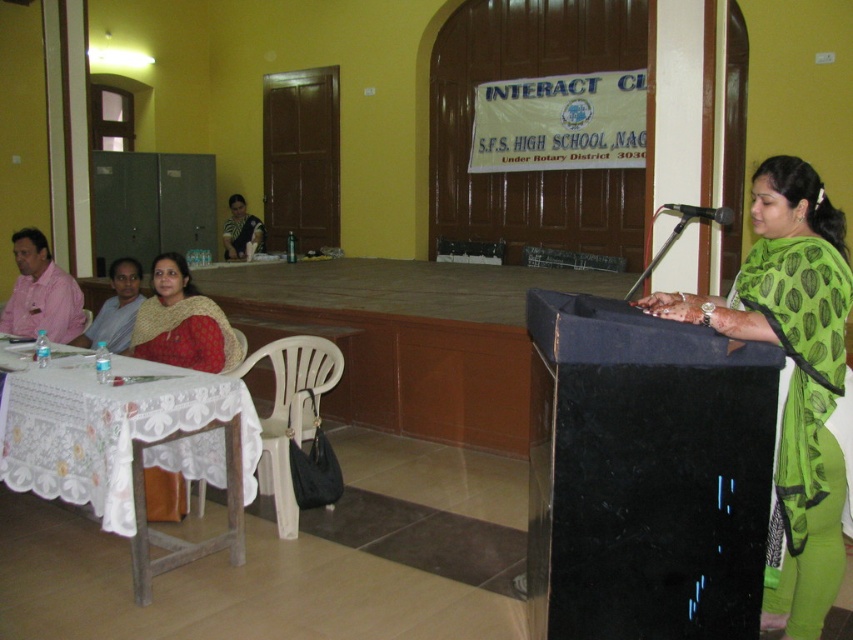
Does matte beige shawl at lower left have a greater width compared to matte pink shirt at left?

Correct, the width of matte beige shawl at lower left exceeds that of matte pink shirt at left.

Does matte beige shawl at lower left have a smaller size compared to matte pink shirt at left?

Actually, matte beige shawl at lower left might be larger than matte pink shirt at left.

Image resolution: width=853 pixels, height=640 pixels. Identify the location of matte beige shawl at lower left. (183, 323).

Is point (206, 305) closer to viewer compared to point (231, 230)?

Yes, point (206, 305) is in front of point (231, 230).

Which is behind, point (195, 324) or point (254, 225)?

The point (254, 225) is behind.

This screenshot has width=853, height=640. Identify the location of matte beige shawl at lower left. (183, 323).

Image resolution: width=853 pixels, height=640 pixels. What do you see at coordinates (41, 292) in the screenshot? I see `matte pink shirt at left` at bounding box center [41, 292].

Which is behind, point (45, 246) or point (111, 308)?

The point (111, 308) is more distant.

Locate an element on the screen. Image resolution: width=853 pixels, height=640 pixels. matte pink shirt at left is located at coordinates (41, 292).